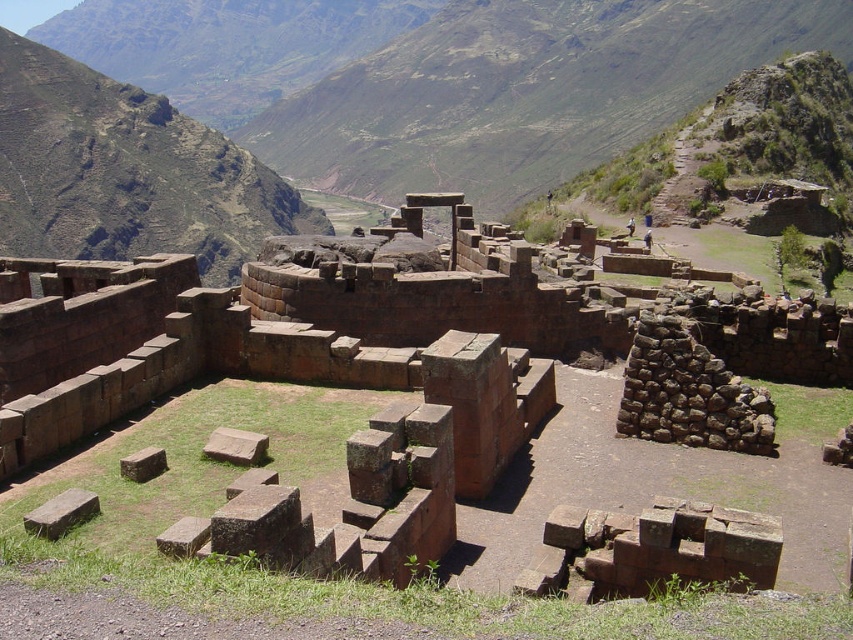
Question: Which point is closer to the camera taking this photo?

Choices:
 (A) (471, 401)
 (B) (22, 49)

Answer: (A)

Question: Which of the following is the closest to the observer?

Choices:
 (A) (96, 212)
 (B) (59, 385)

Answer: (B)

Question: Does brown stone ruins at center appear over green rocky mountain at upper left?

Choices:
 (A) no
 (B) yes

Answer: (A)

Question: Can you confirm if brown stone ruins at center is wider than green rocky mountain at upper left?

Choices:
 (A) yes
 (B) no

Answer: (B)

Question: Where is brown stone ruins at center located in relation to green rocky mountain at upper left in the image?

Choices:
 (A) left
 (B) right

Answer: (B)